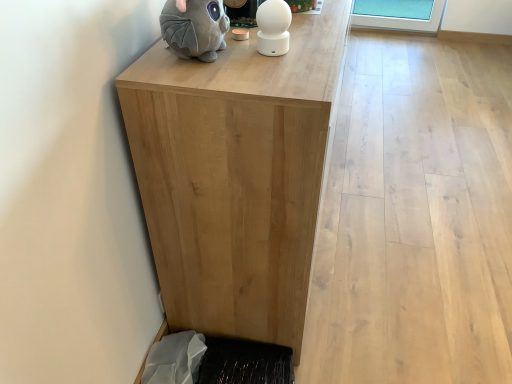
Find the location of a particular element. The width and height of the screenshot is (512, 384). empty space that is ontop of black textured mat at lower left (from a real-world perspective) is located at coordinates (249, 364).